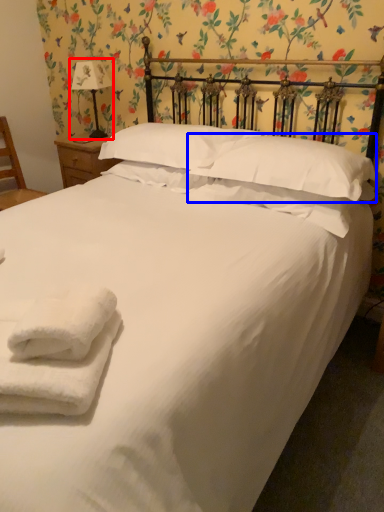
Question: Which object is closer to the camera taking this photo, table lamp (highlighted by a red box) or pillow (highlighted by a blue box)?

Choices:
 (A) table lamp
 (B) pillow

Answer: (B)